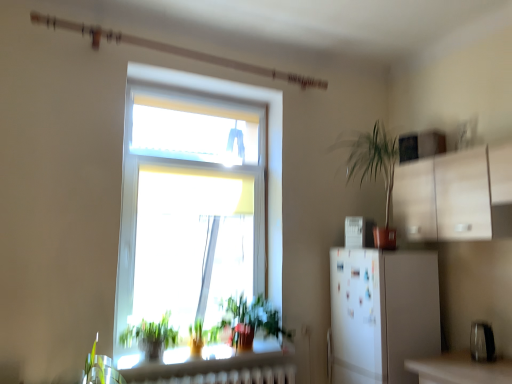
Question: Does green leafy plant at lower left, the first vegetation in the left-to-right sequence, turn towards metallic silver toaster at lower right, the 1th appliance from the bottom?

Choices:
 (A) no
 (B) yes

Answer: (A)

Question: Is green leafy plant at lower left, the first vegetation in the left-to-right sequence, positioned far away from metallic silver toaster at lower right, placed as the first appliance when sorted from front to back?

Choices:
 (A) no
 (B) yes

Answer: (B)

Question: Considering the relative positions of green leafy plant at lower left, which is counted as the 2th vegetation, starting from the right, and metallic silver toaster at lower right, the 1th appliance from the bottom, in the image provided, is green leafy plant at lower left, which is counted as the 2th vegetation, starting from the right, in front of metallic silver toaster at lower right, the 1th appliance from the bottom,?

Choices:
 (A) no
 (B) yes

Answer: (B)

Question: Does green leafy plant at lower left, which is counted as the 2th vegetation, starting from the right, have a lesser width compared to metallic silver toaster at lower right, the 1th appliance from the bottom?

Choices:
 (A) no
 (B) yes

Answer: (A)

Question: Is green leafy plant at lower left, which is counted as the 2th vegetation, starting from the right, touching metallic silver toaster at lower right, placed as the first appliance when sorted from front to back?

Choices:
 (A) no
 (B) yes

Answer: (A)

Question: From a real-world perspective, does green leafy plant at lower left, the first vegetation in the left-to-right sequence, sit lower than metallic silver toaster at lower right, the 2th appliance when ordered from back to front?

Choices:
 (A) no
 (B) yes

Answer: (A)

Question: Is metallic silver toaster at lower right, which is counted as the 2th appliance, starting from the left, bigger than green leafy plant at lower left, which is counted as the 2th vegetation, starting from the right?

Choices:
 (A) no
 (B) yes

Answer: (A)

Question: Would you say metallic silver toaster at lower right, positioned as the 2th appliance in top-to-bottom order, contains green leafy plant at lower left, which is counted as the 2th vegetation, starting from the right?

Choices:
 (A) no
 (B) yes

Answer: (A)

Question: Is metallic silver toaster at lower right, placed as the first appliance when sorted from front to back, with green leafy plant at lower left, which is counted as the 2th vegetation, starting from the right?

Choices:
 (A) yes
 (B) no

Answer: (B)

Question: From a real-world perspective, is metallic silver toaster at lower right, the 2th appliance when ordered from back to front, located higher than green leafy plant at lower left, which is counted as the 2th vegetation, starting from the right?

Choices:
 (A) yes
 (B) no

Answer: (B)

Question: Considering the relative positions of metallic silver toaster at lower right, the 1th appliance in the right-to-left sequence, and green leafy plant at lower left, the first vegetation in the left-to-right sequence, in the image provided, is metallic silver toaster at lower right, the 1th appliance in the right-to-left sequence, to the right of green leafy plant at lower left, the first vegetation in the left-to-right sequence, from the viewer's perspective?

Choices:
 (A) yes
 (B) no

Answer: (A)

Question: From the image's perspective, does metallic silver toaster at lower right, placed as the first appliance when sorted from front to back, appear lower than green leafy plant at lower left, the first vegetation in the left-to-right sequence?

Choices:
 (A) yes
 (B) no

Answer: (A)

Question: Would you say white glossy refrigerator at right, which is the first appliance in back-to-front order, is outside green leafy plant at lower left, the first vegetation in the left-to-right sequence?

Choices:
 (A) yes
 (B) no

Answer: (A)